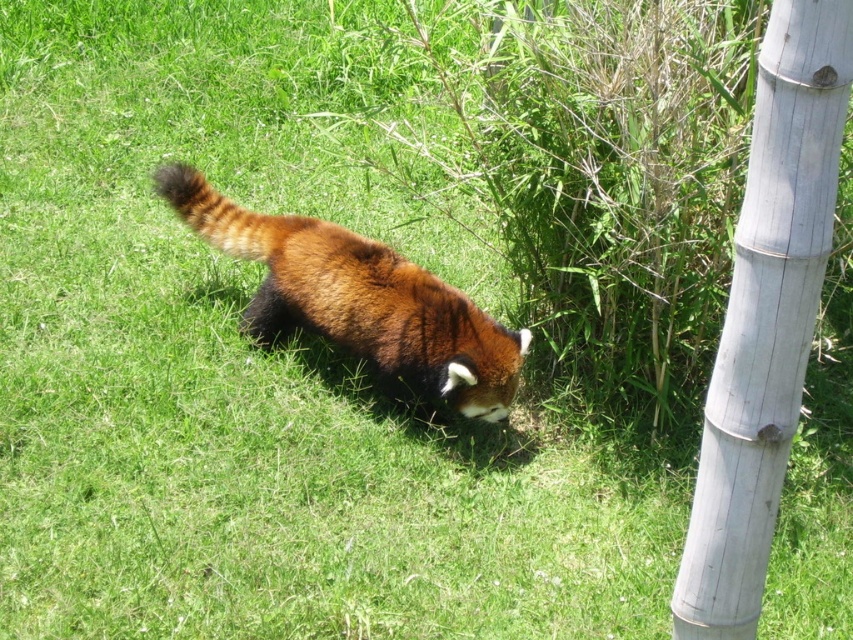
Looking at this image, which is below, white bamboo pole at right or fuzzy reddish-brown animal at center?

white bamboo pole at right is lower down.

Between point (837, 118) and point (512, 371), which one is positioned behind?

The point (512, 371) is more distant.

Find the location of a particular element. The image size is (853, 640). white bamboo pole at right is located at coordinates (766, 316).